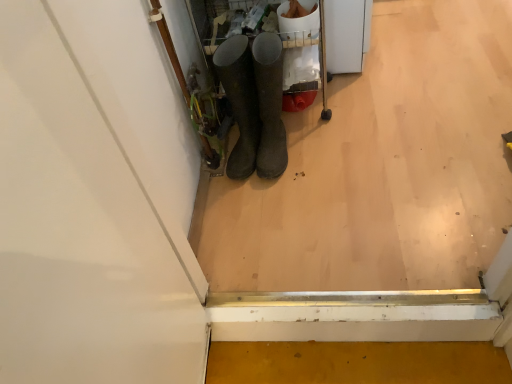
What is the approximate height of dark brown rubber boots at center?

14.60 inches.

What do you see at coordinates (270, 105) in the screenshot? This screenshot has width=512, height=384. I see `dark brown rubber boots at center` at bounding box center [270, 105].

You are a GUI agent. You are given a task and a screenshot of the screen. Output one action in this format:
    pyautogui.click(x=<x>, y=<y>)
    Task: Click on the dark brown rubber boots at center
    
    Given the screenshot: What is the action you would take?
    pyautogui.click(x=270, y=105)

Where is `dark brown rubber boots at center`? Image resolution: width=512 pixels, height=384 pixels. dark brown rubber boots at center is located at coordinates (270, 105).